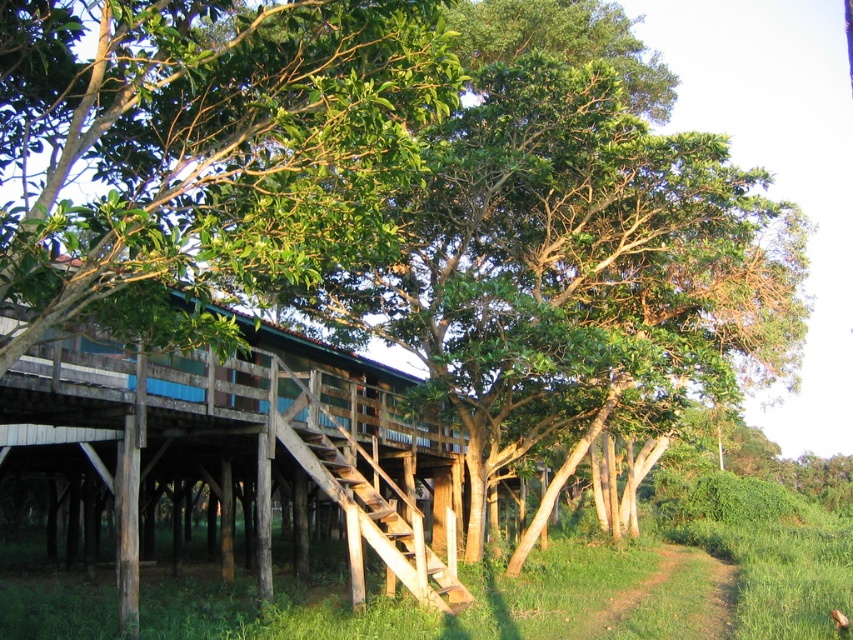
This screenshot has height=640, width=853. In order to click on wooden hut at center in this screenshot , I will do `click(252, 428)`.

Looking at this image, which is more to the right, wooden hut at center or green grassy path at lower right?

From the viewer's perspective, green grassy path at lower right appears more on the right side.

Find the location of a particular element. This screenshot has width=853, height=640. wooden hut at center is located at coordinates (252, 428).

Between point (126, 392) and point (361, 532), which one is positioned behind?

Point (361, 532)

Is point (21, 420) more distant than point (368, 520)?

No, it is not.

Does point (433, 477) come behind point (434, 580)?

Yes, it is behind point (434, 580).

This screenshot has width=853, height=640. I want to click on wooden hut at center, so click(252, 428).

Which is below, green grassy path at lower right or wooden stairs at center?

green grassy path at lower right is below.

Looking at this image, can you confirm if green grassy path at lower right is positioned to the right of wooden stairs at center?

Yes, green grassy path at lower right is to the right of wooden stairs at center.

Is point (604, 609) farther from viewer compared to point (335, 492)?

Yes.

I want to click on green grassy path at lower right, so click(671, 600).